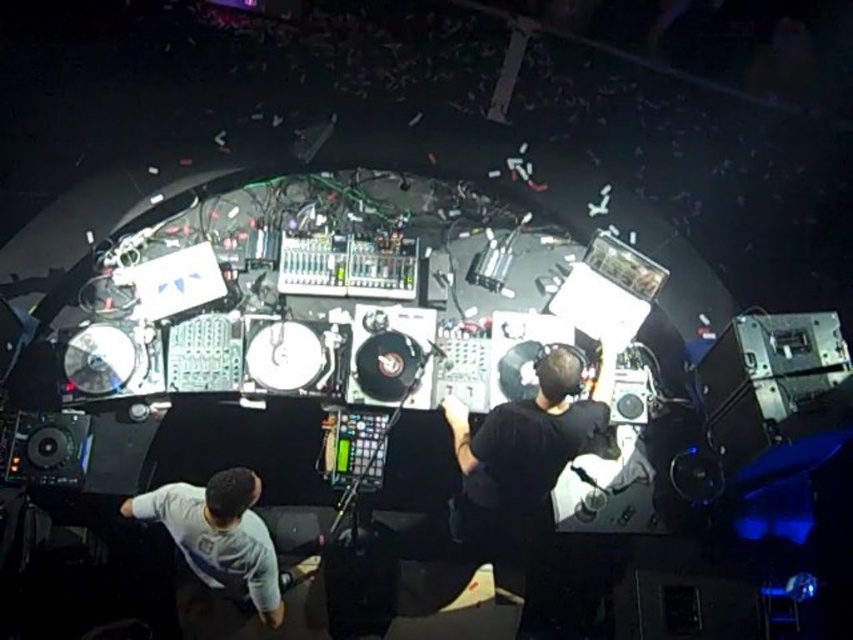
You are a photographer standing at the DJ booth. You want to take a photo of the black matte headphones at center and the white matte shirt at lower left. Can you fit both objects in the frame if your camera has a 1.5 meter wide field of view?

The black matte headphones at center might be wider than white matte shirt at lower left. However, since the field of view is 1.5 meters, it is possible that both objects can fit within the frame if their combined width does not exceed 1.5 meters. However, without exact measurements, it is uncertain.

You are a photographer positioned above the DJ booth. You need to capture a photo that includes both the black matte headphones at center and the white matte shirt at lower left. Which object should you focus on first to ensure both are in frame?

The black matte headphones at center is above the white matte shirt at lower left, so you should focus on the white matte shirt at lower left first to ensure both are in frame.

You are a photographer taking a picture of the DJ booth. You need to place a small LED light at the exact center of the DJ booth to highlight the black matte headphones at center. Based on the coordinates provided, is the point at (524,449) the correct location for the LED light?

Yes, the point at (524,449) corresponds to the black matte headphones at center, so placing the LED light there will correctly highlight them.